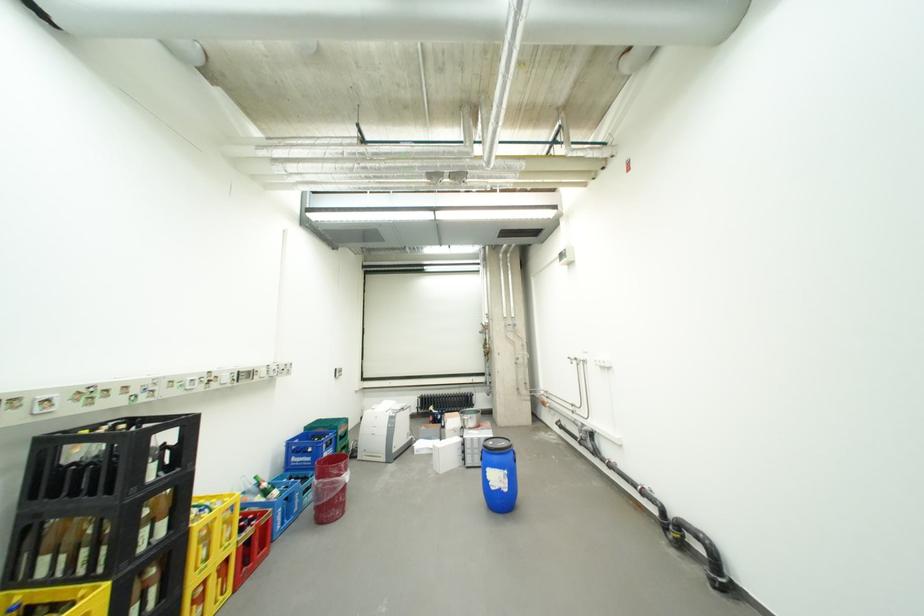
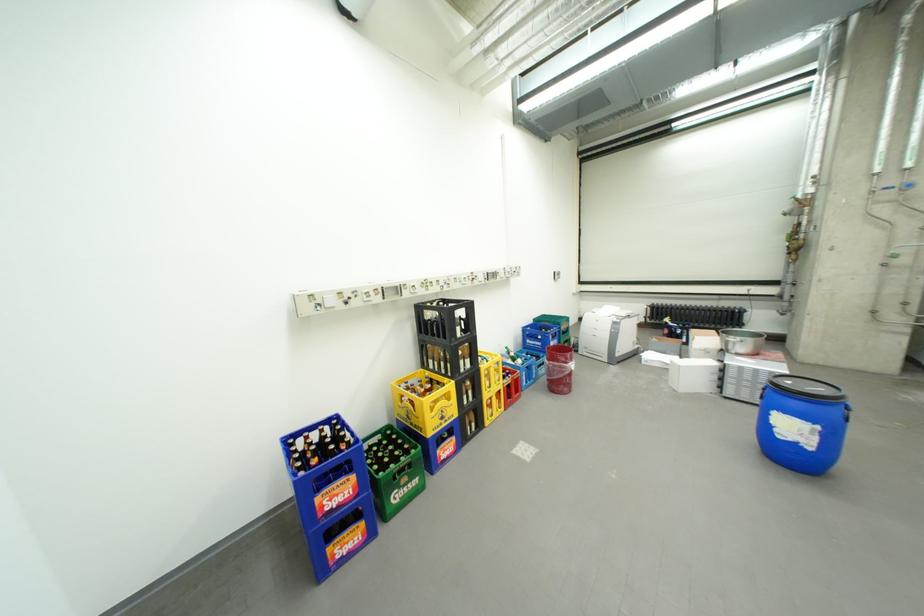
In the second image, find the point that corresponds to point 334,455 in the first image.

(562, 344)